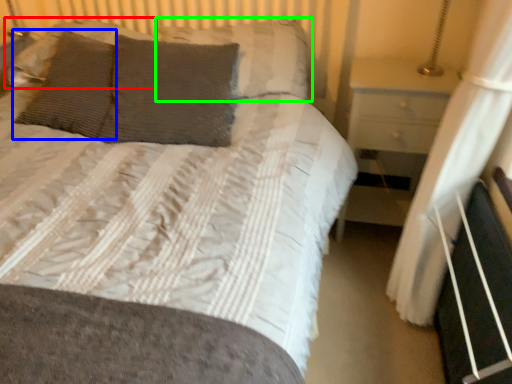
Question: Which object is the closest to the pillow (highlighted by a red box)? Choose among these: pillow (highlighted by a blue box) or pillow (highlighted by a green box).

Choices:
 (A) pillow
 (B) pillow

Answer: (A)